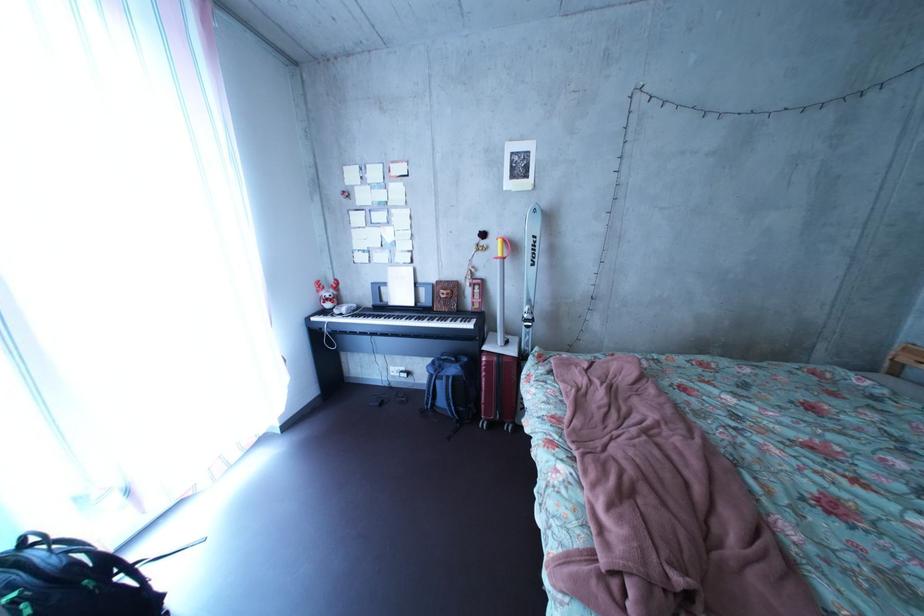
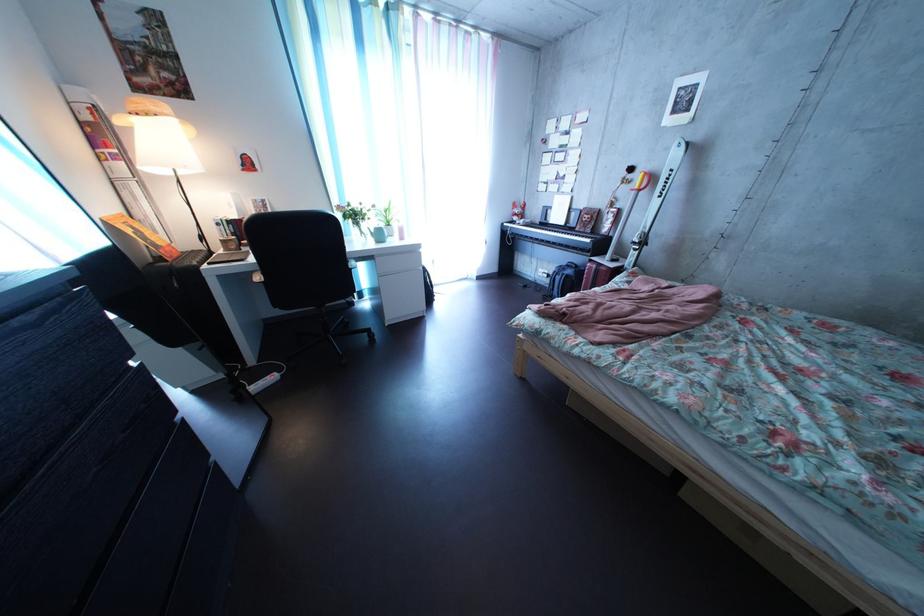
The point at (x=395, y=367) is marked in the first image. Where is the corresponding point in the second image?

(550, 269)